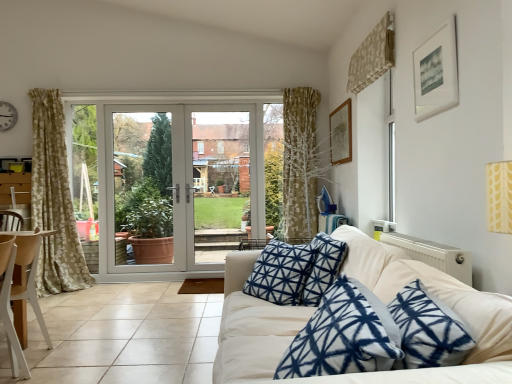
Question: From the image's perspective, is white matte picture frame at upper right, the 2th picture frame positioned from the left, on beige tile at lower left?

Choices:
 (A) yes
 (B) no

Answer: (A)

Question: Is white matte picture frame at upper right, the 2th picture frame positioned from the left, facing away from beige tile at lower left?

Choices:
 (A) no
 (B) yes

Answer: (A)

Question: Is white matte picture frame at upper right, which is counted as the first picture frame, starting from the right, to the right of beige tile at lower left from the viewer's perspective?

Choices:
 (A) no
 (B) yes

Answer: (B)

Question: Does white matte picture frame at upper right, the 2th picture frame positioned from the left, have a greater height compared to beige tile at lower left?

Choices:
 (A) yes
 (B) no

Answer: (A)

Question: From the image's perspective, is white matte picture frame at upper right, which appears as the 2th picture frame when viewed from the back, located beneath beige tile at lower left?

Choices:
 (A) yes
 (B) no

Answer: (B)

Question: Does white matte picture frame at upper right, which appears as the 2th picture frame when viewed from the back, turn towards beige tile at lower left?

Choices:
 (A) yes
 (B) no

Answer: (B)

Question: Does wooden picture frame at upper right, placed as the second picture frame when sorted from front to back, have a greater width compared to wooden chair at left?

Choices:
 (A) yes
 (B) no

Answer: (B)

Question: Considering the relative sizes of wooden picture frame at upper right, which appears as the 2th picture frame when viewed from the right, and wooden chair at left in the image provided, is wooden picture frame at upper right, which appears as the 2th picture frame when viewed from the right, bigger than wooden chair at left?

Choices:
 (A) yes
 (B) no

Answer: (B)

Question: From the image's perspective, does wooden picture frame at upper right, the first picture frame viewed from the left, appear higher than wooden chair at left?

Choices:
 (A) no
 (B) yes

Answer: (B)

Question: Considering the relative positions of wooden picture frame at upper right, the first picture frame viewed from the left, and wooden chair at left in the image provided, is wooden picture frame at upper right, the first picture frame viewed from the left, behind wooden chair at left?

Choices:
 (A) yes
 (B) no

Answer: (A)

Question: Is wooden picture frame at upper right, placed as the second picture frame when sorted from front to back, to the left of wooden chair at left from the viewer's perspective?

Choices:
 (A) no
 (B) yes

Answer: (A)

Question: Could wooden chair at left be considered to be inside wooden picture frame at upper right, placed as the second picture frame when sorted from front to back?

Choices:
 (A) no
 (B) yes

Answer: (A)

Question: Is white glossy door at center bigger than wooden chair at left?

Choices:
 (A) yes
 (B) no

Answer: (A)